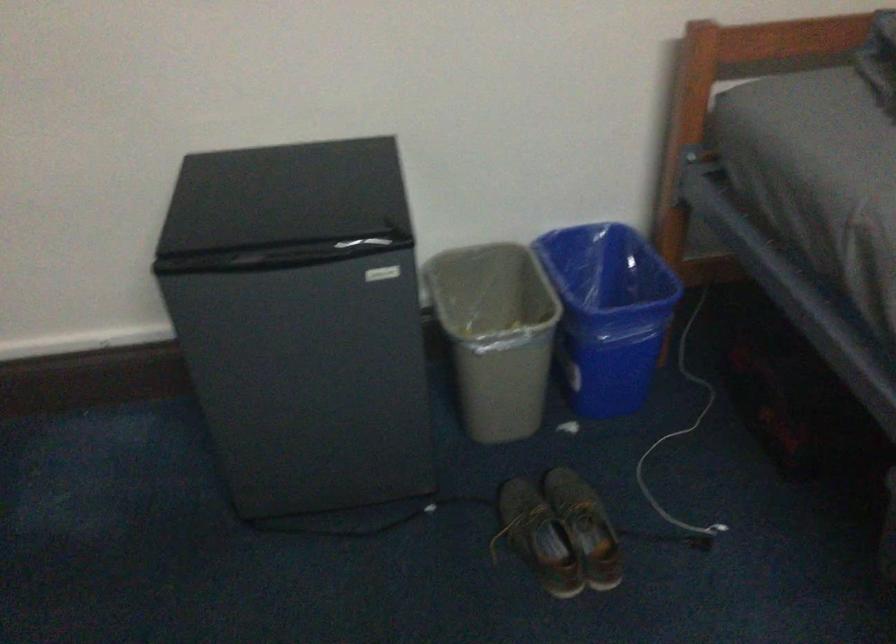
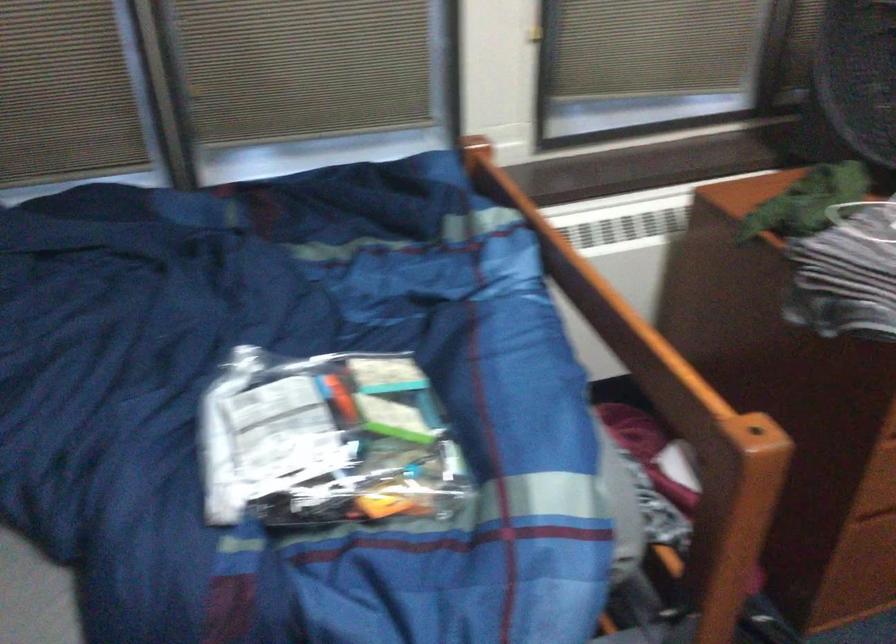
How did the camera likely rotate?

The camera rotated toward right-down.